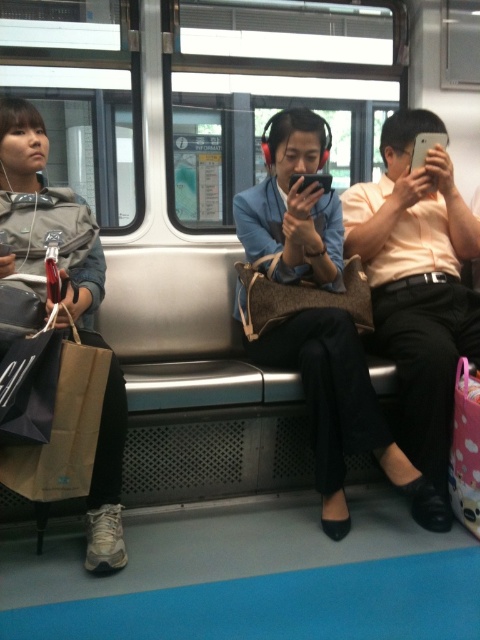
Based on the photo, you are a photographer trying to capture a photo of the matte black pants at center and the matte orange shirt at center in the subway car. To ensure both are in focus, you need to know their relative sizes. Which object is wider?

The matte black pants at center might be wider than the matte orange shirt at center according to the description provided.

You are a passenger in the subway car and want to ask the person in the matte orange shirt at center a question. Which direction should you walk to approach them from the matte gray jacket at left?

The matte orange shirt at center is positioned over the matte gray jacket at left, so you should walk forward towards the matte orange shirt at center to approach them from the matte gray jacket at left.

You are a photographer standing in the subway car and want to take a picture of both the matte orange shirt at center and the matte gray jacket at left. Which one should you focus on first if you want to capture them both in the same frame?

The matte orange shirt at center is positioned on the right side of matte gray jacket at left, so you should focus on the matte gray jacket at left first to ensure both are in the same frame.